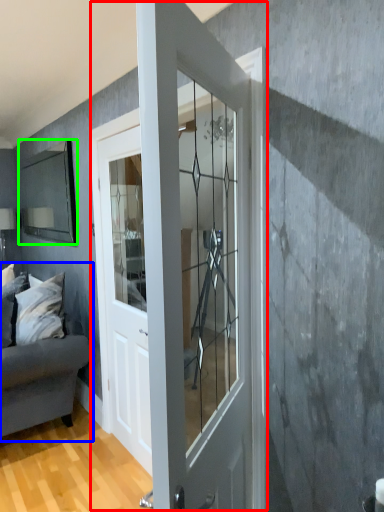
Question: Estimate the real-world distances between objects in this image. Which object is closer to door (highlighted by a red box), studio couch (highlighted by a blue box) or mirror (highlighted by a green box)?

Choices:
 (A) studio couch
 (B) mirror

Answer: (A)